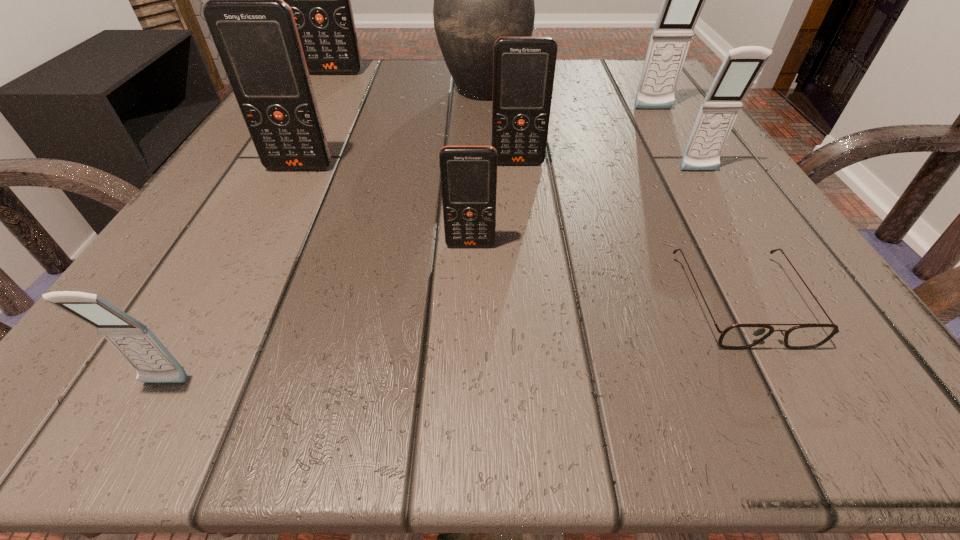
Point out which orange cellular telephone is positioned as the third nearest to the biggest gray cellular telephone. Please provide its 2D coordinates. Your answer should be formatted as a tuple, i.e. [(x, y)], where the tuple contains the x and y coordinates of a point satisfying the conditions above.

[(254, 31)]

Where is `gray cellular telephone that can be found as the closest to the second farthest gray cellular telephone`? The width and height of the screenshot is (960, 540). gray cellular telephone that can be found as the closest to the second farthest gray cellular telephone is located at coordinates (683, 0).

Where is `gray cellular telephone that is the nearest to the second biggest orange cellular telephone`? The image size is (960, 540). gray cellular telephone that is the nearest to the second biggest orange cellular telephone is located at coordinates (133, 340).